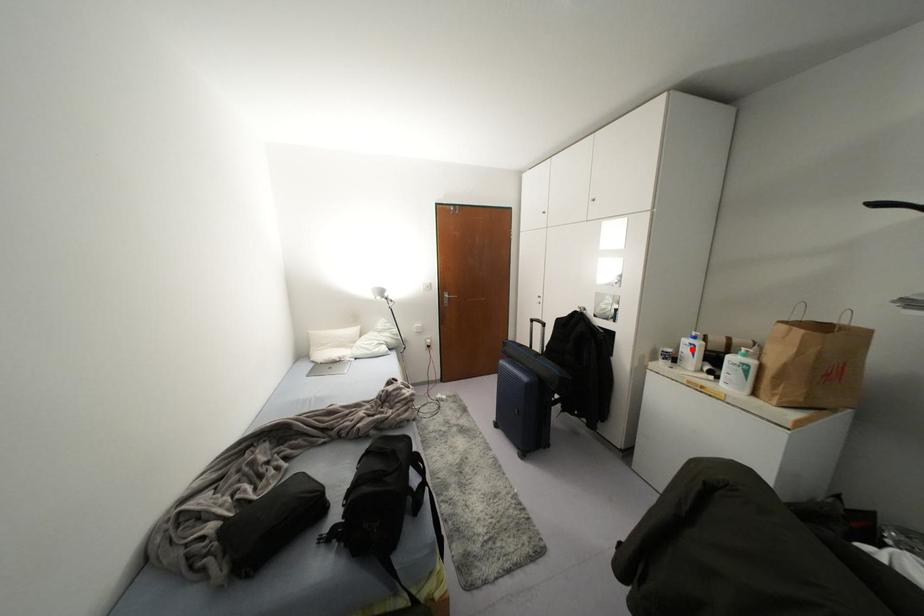
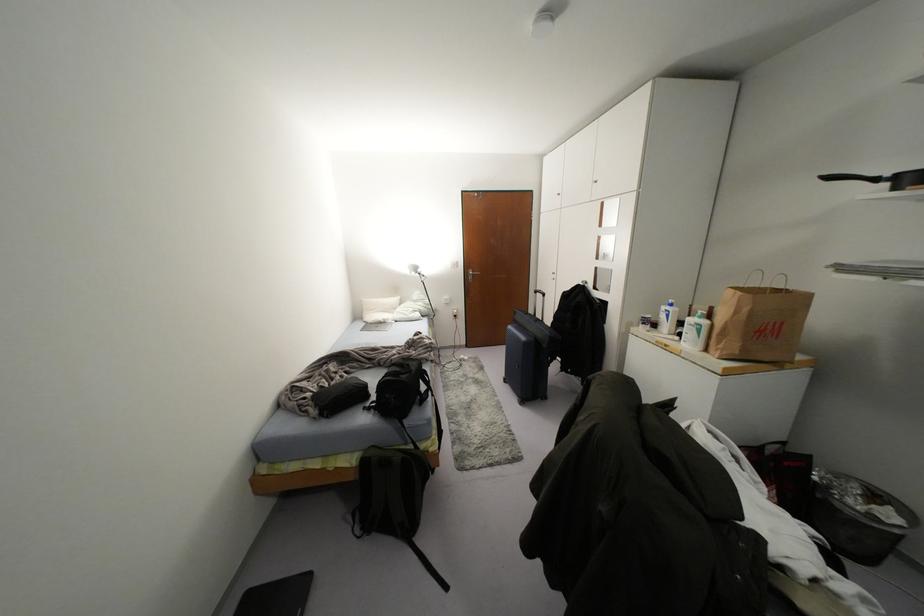
Locate, in the second image, the point that corresponds to the highlighted location in the first image.

(666, 315)